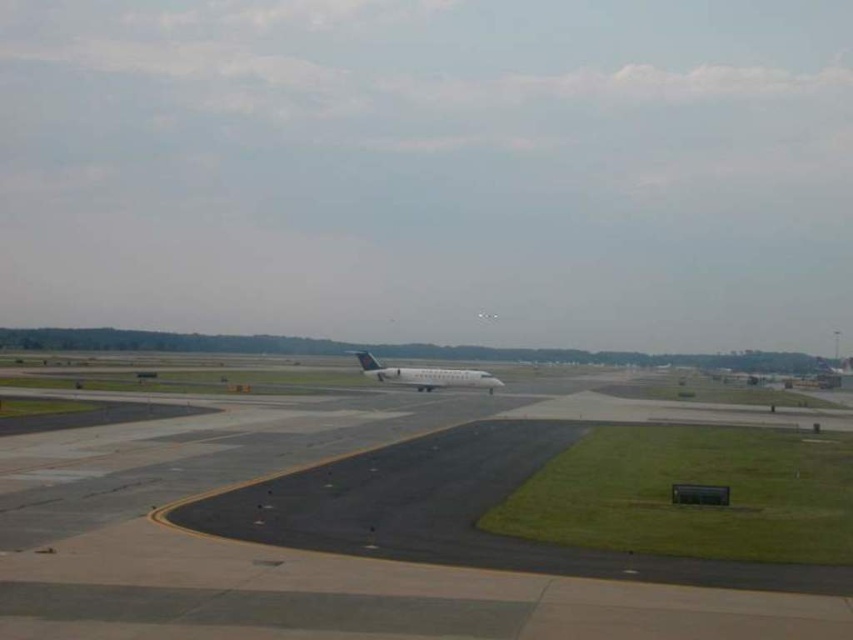
Who is positioned more to the left, black asphalt tarmac at center or white matte airplane at center?

Positioned to the left is black asphalt tarmac at center.

Is black asphalt tarmac at center taller than white matte airplane at center?

In fact, black asphalt tarmac at center may be shorter than white matte airplane at center.

You are a GUI agent. You are given a task and a screenshot of the screen. Output one action in this format:
    pyautogui.click(x=<x>, y=<y>)
    Task: Click on the black asphalt tarmac at center
    The width and height of the screenshot is (853, 640).
    Given the screenshot: What is the action you would take?
    pyautogui.click(x=318, y=552)

Find the location of a particular element. black asphalt tarmac at center is located at coordinates (318, 552).